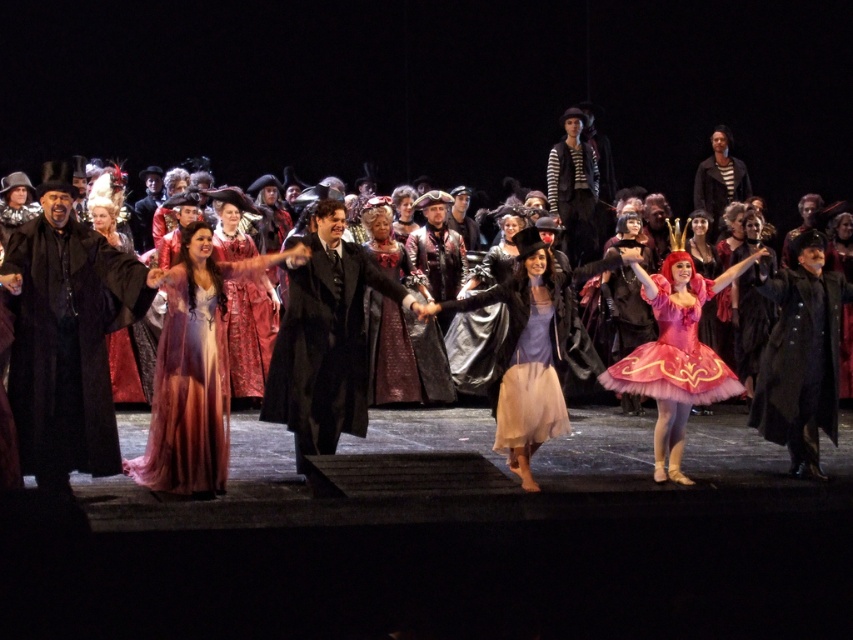
You are a stagehand responsible for placing a 15 feet long decorative banner between the pink tulle tutu at center and the velvet maroon dress at center. Can you fit the banner between them without overlapping either of the costumes?

The distance between the pink tulle tutu at center and the velvet maroon dress at center is 16.83 feet. Since the banner is 15 feet long, it can be placed between them without overlapping as there is enough space.

You are a stagehand setting up a spotlight for the performers. You need to position the spotlight so it can illuminate both the shiny black coat at center and the shiny pink tulle dress at lower right. Based on their positions, which direction should you aim the spotlight to ensure both are lit evenly?

The shiny black coat at center is positioned on the left side of the shiny pink tulle dress at lower right. To illuminate both evenly, aim the spotlight from the direction opposite to the side where the coat is, so that both objects are equally lit.

You are a stagehand preparing to adjust the spotlight for the performers. The pink tulle tutu at center and the velvet maroon dress at center are both in your line of sight. Which of these two items requires a wider spotlight coverage to fully illuminate?

The pink tulle tutu at center requires a wider spotlight coverage because its width surpasses that of the velvet maroon dress at center.